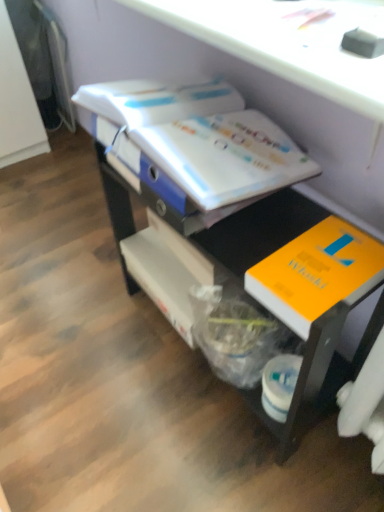
Question: From their relative heights in the image, would you say orange matte book at lower right, marked as the 2th book in a top-to-bottom arrangement, is taller or shorter than white glossy book at upper center, the 2th book ordered from the bottom?

Choices:
 (A) short
 (B) tall

Answer: (A)

Question: Considering their positions, is orange matte book at lower right, marked as the 2th book in a top-to-bottom arrangement, located in front of or behind white glossy book at upper center, which ranks as the first book in top-to-bottom order?

Choices:
 (A) front
 (B) behind

Answer: (A)

Question: Which object is positioned farthest from the matte black drawer at center?

Choices:
 (A) orange matte book at lower right, marked as the 2th book in a top-to-bottom arrangement
 (B) white glossy book at upper center, which ranks as the first book in top-to-bottom order

Answer: (B)

Question: Which is farther from the matte black drawer at center?

Choices:
 (A) orange matte book at lower right, acting as the first book starting from the bottom
 (B) white glossy book at upper center, which ranks as the first book in top-to-bottom order

Answer: (B)